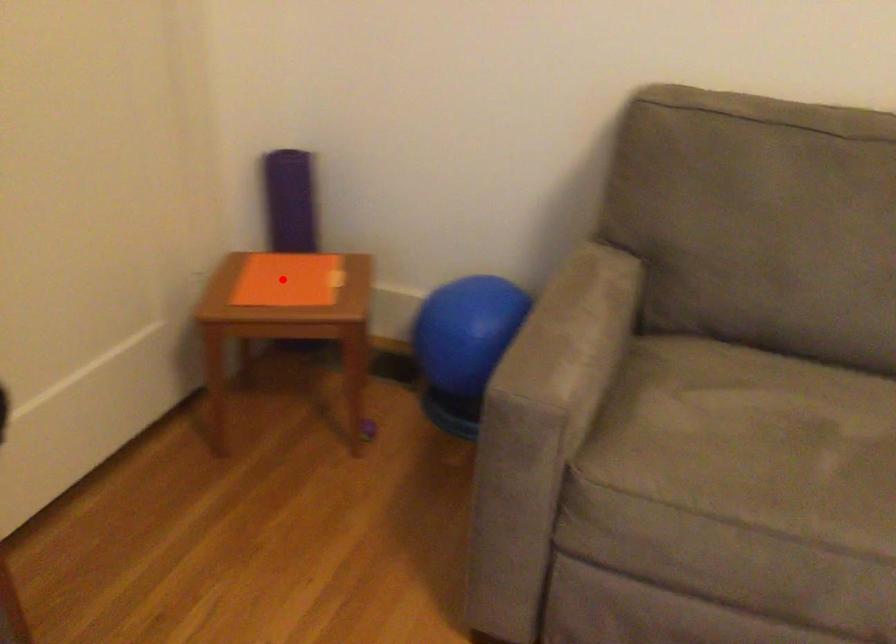
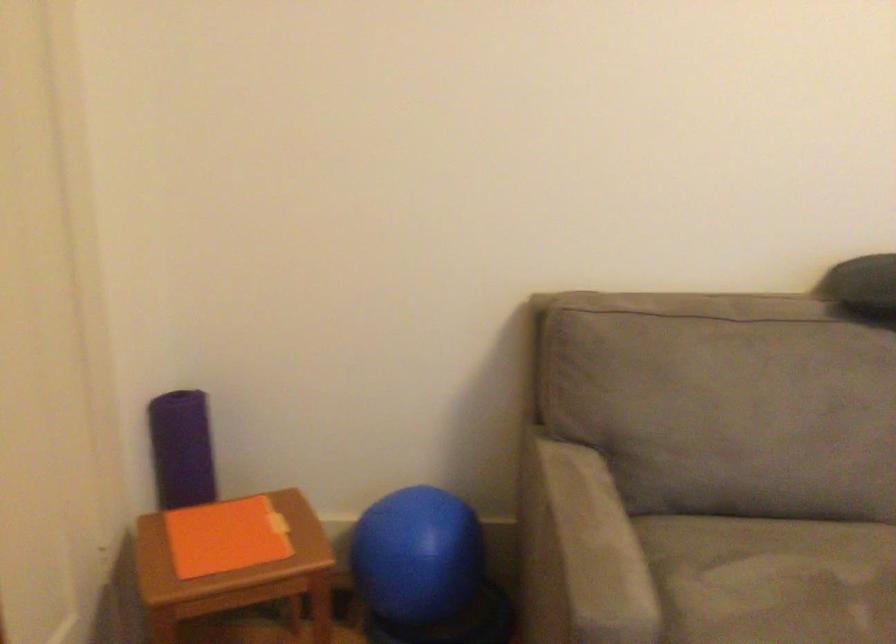
Locate, in the second image, the point that corresponds to the highlighted location in the first image.

(226, 536)